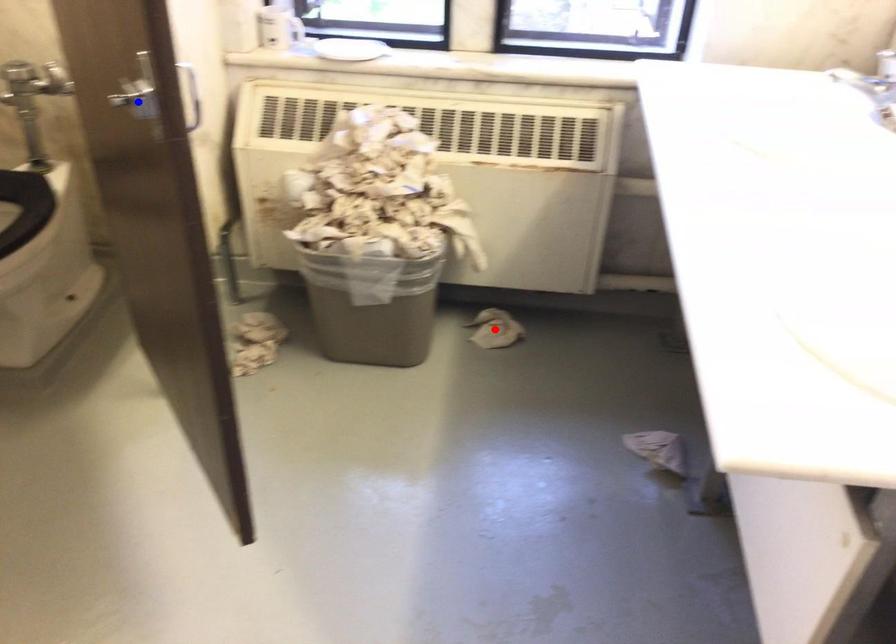
Question: In the image, two points are highlighted. Which point is nearer to the camera? Reply with the corresponding letter.

Choices:
 (A) blue point
 (B) red point

Answer: (A)